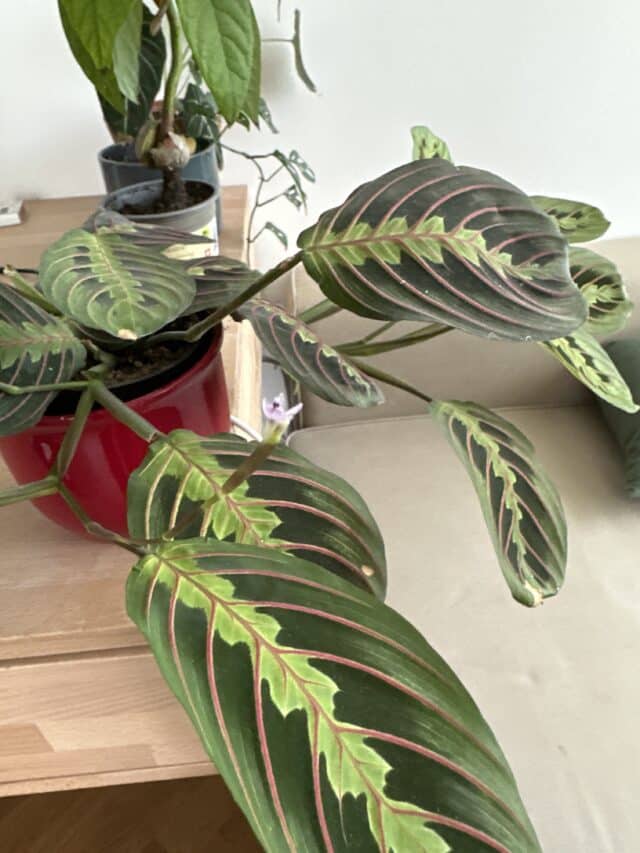
Locate an element on the screen. Image resolution: width=640 pixels, height=853 pixels. table is located at coordinates (60, 583).